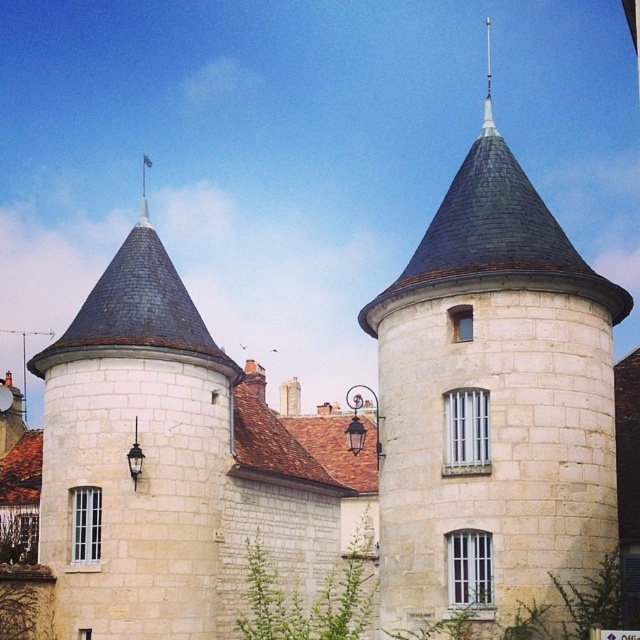
Does point (608, 436) come in front of point (141, 506)?

That is True.

Is point (496, 518) behind point (61, 621)?

That is False.

Is point (460, 477) more distant than point (182, 532)?

That is False.

Image resolution: width=640 pixels, height=640 pixels. Identify the location of white stone tower at center. (492, 401).